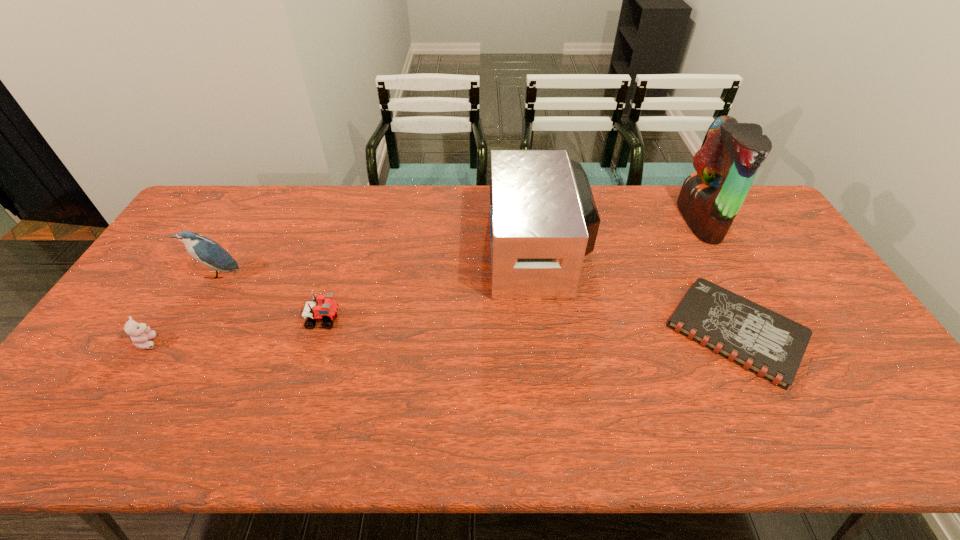
You are a GUI agent. You are given a task and a screenshot of the screen. Output one action in this format:
    pyautogui.click(x=<x>, y=<y>)
    Task: Click on the free space that satisfies the following two spatial constraints: 1. at the tip of the shortest object's beak; 2. on the right side of the third tallest object
    
    Given the screenshot: What is the action you would take?
    pyautogui.click(x=184, y=332)

At what (x,y) coordinates should I click in order to perform the action: click on vacant space that satisfies the following two spatial constraints: 1. at the tip of the bird's beak; 2. at the face of the teddy bear. Please return your answer as a coordinate pair (x, y). The height and width of the screenshot is (540, 960). Looking at the image, I should click on (179, 342).

This screenshot has width=960, height=540. What are the coordinates of `vacant region that satisfies the following two spatial constraints: 1. on the front-facing side of the notebook; 2. on the right side of the microwave oven` in the screenshot? It's located at (549, 332).

Identify the location of free space that satisfies the following two spatial constraints: 1. on the front-facing side of the notebook; 2. on the right side of the third object from right to left. This screenshot has width=960, height=540. (549, 332).

Find the location of a particular element. free spot that satisfies the following two spatial constraints: 1. at the face of the parrot; 2. at the tip of the bird's beak is located at coordinates (730, 275).

Find the location of a particular element. Image resolution: width=960 pixels, height=540 pixels. free space that satisfies the following two spatial constraints: 1. on the front-facing side of the fifth shortest object; 2. at the tip of the bird's beak is located at coordinates (541, 275).

The height and width of the screenshot is (540, 960). I want to click on free space that satisfies the following two spatial constraints: 1. on the front-facing side of the microwave oven; 2. on the back side of the shortest object, so click(549, 332).

You are a GUI agent. You are given a task and a screenshot of the screen. Output one action in this format:
    pyautogui.click(x=<x>, y=<y>)
    Task: Click on the free location that satisfies the following two spatial constraints: 1. at the tip of the bird's beak; 2. at the face of the teddy bear
    The width and height of the screenshot is (960, 540).
    Given the screenshot: What is the action you would take?
    pyautogui.click(x=179, y=342)

Locate an element on the screen. This screenshot has width=960, height=540. free location that satisfies the following two spatial constraints: 1. on the front-facing side of the fourth object from left to right; 2. on the right side of the notebook is located at coordinates (549, 332).

I want to click on blank area in the image that satisfies the following two spatial constraints: 1. on the front-facing side of the notebook; 2. on the left side of the microwave oven, so click(549, 332).